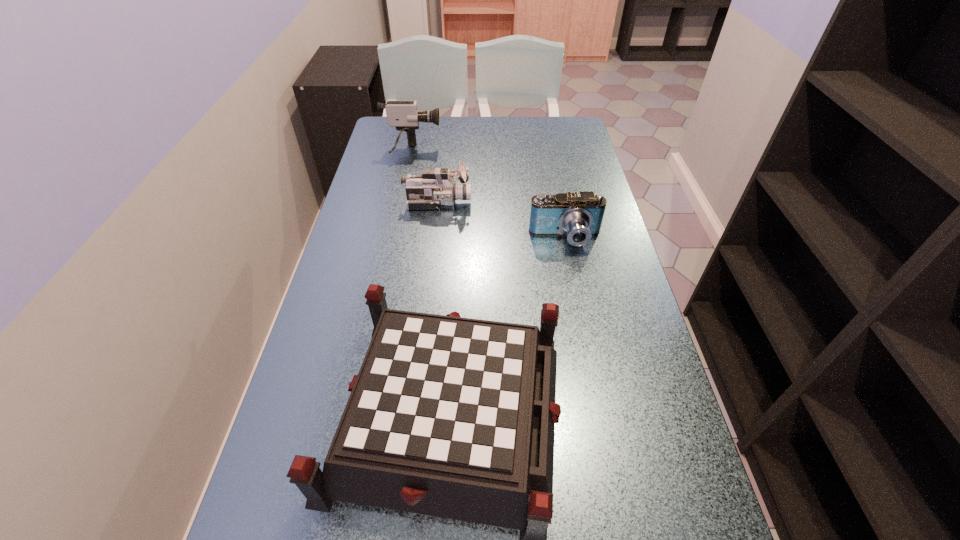
Locate an element on the screen. This screenshot has height=540, width=960. object that is the second closest to the nearest camcorder is located at coordinates (452, 417).

Select which object appears as the third closest to the nearest object. Please provide its 2D coordinates. Your answer should be formatted as a tuple, i.e. [(x, y)], where the tuple contains the x and y coordinates of a point satisfying the conditions above.

[(404, 115)]

Select which camcorder appears as the closest to the second farthest object. Please provide its 2D coordinates. Your answer should be formatted as a tuple, i.e. [(x, y)], where the tuple contains the x and y coordinates of a point satisfying the conditions above.

[(404, 115)]

The width and height of the screenshot is (960, 540). I want to click on camcorder that is the closest one to the nearest object, so click(x=579, y=215).